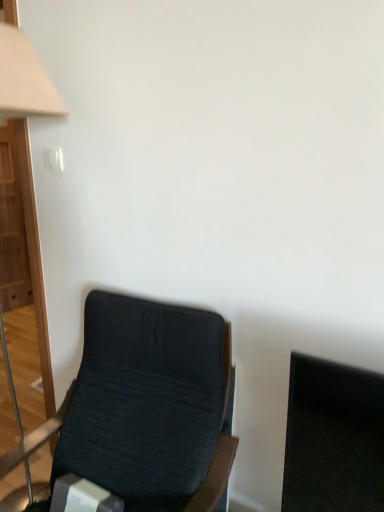
Question: Is beige fabric lampshade at left completely or partially outside of dark fabric chair at lower left?

Choices:
 (A) yes
 (B) no

Answer: (A)

Question: Is dark fabric chair at lower left completely or partially inside beige fabric lampshade at left?

Choices:
 (A) yes
 (B) no

Answer: (B)

Question: From the image's perspective, would you say beige fabric lampshade at left is positioned over dark fabric chair at lower left?

Choices:
 (A) yes
 (B) no

Answer: (A)

Question: Is beige fabric lampshade at left wider than dark fabric chair at lower left?

Choices:
 (A) yes
 (B) no

Answer: (B)

Question: Considering the relative positions of beige fabric lampshade at left and dark fabric chair at lower left in the image provided, is beige fabric lampshade at left behind dark fabric chair at lower left?

Choices:
 (A) no
 (B) yes

Answer: (B)

Question: Can you confirm if beige fabric lampshade at left is positioned to the left of dark fabric chair at lower left?

Choices:
 (A) yes
 (B) no

Answer: (A)

Question: Can you confirm if dark fabric chair at lower left is bigger than beige fabric lampshade at left?

Choices:
 (A) no
 (B) yes

Answer: (B)

Question: From the image's perspective, is dark fabric chair at lower left on top of beige fabric lampshade at left?

Choices:
 (A) no
 (B) yes

Answer: (A)

Question: Does dark fabric chair at lower left have a smaller size compared to beige fabric lampshade at left?

Choices:
 (A) yes
 (B) no

Answer: (B)

Question: Is beige fabric lampshade at left a part of dark fabric chair at lower left?

Choices:
 (A) no
 (B) yes

Answer: (A)

Question: Would you say dark fabric chair at lower left is outside beige fabric lampshade at left?

Choices:
 (A) yes
 (B) no

Answer: (A)

Question: Is dark fabric chair at lower left aimed at beige fabric lampshade at left?

Choices:
 (A) yes
 (B) no

Answer: (B)

Question: Considering the relative positions of dark fabric chair at lower left and beige fabric lampshade at left in the image provided, is dark fabric chair at lower left to the left or to the right of beige fabric lampshade at left?

Choices:
 (A) left
 (B) right

Answer: (B)